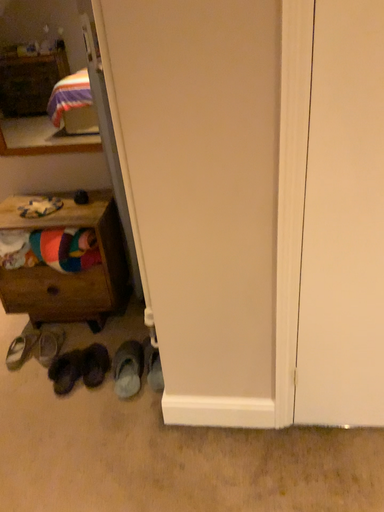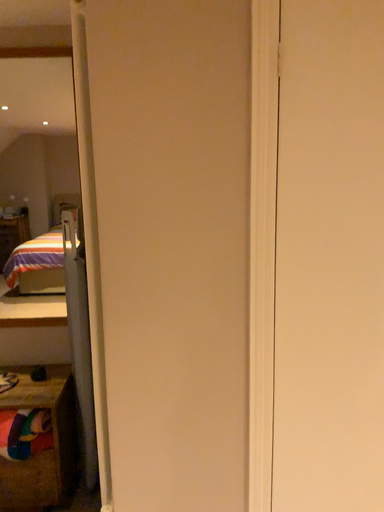
Question: Which way did the camera rotate in the video?

Choices:
 (A) rotated upward
 (B) rotated downward

Answer: (A)